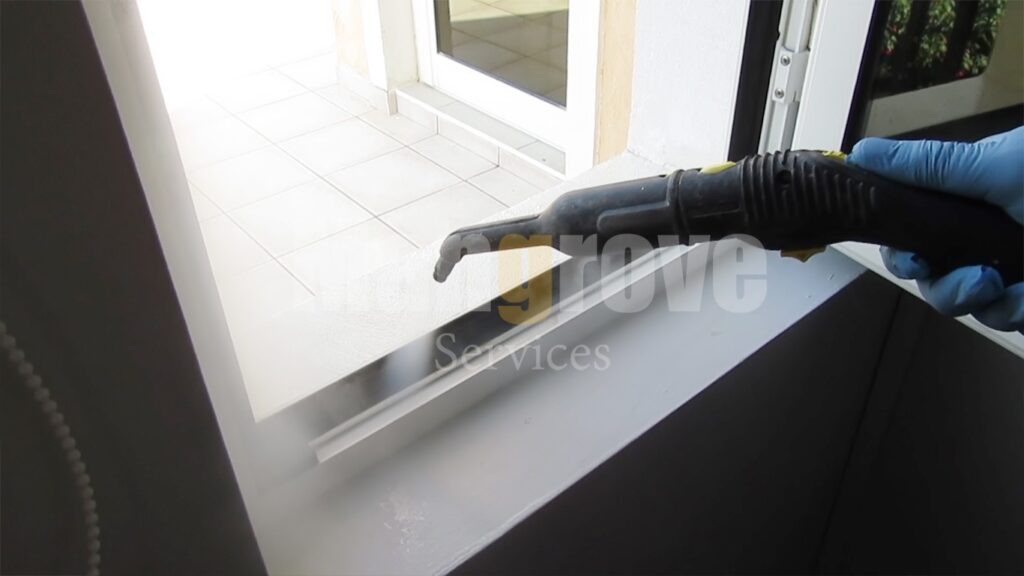
The height and width of the screenshot is (576, 1024). Identify the location of row of beads on left side of screen, possible a piece of furniture. (87, 502).